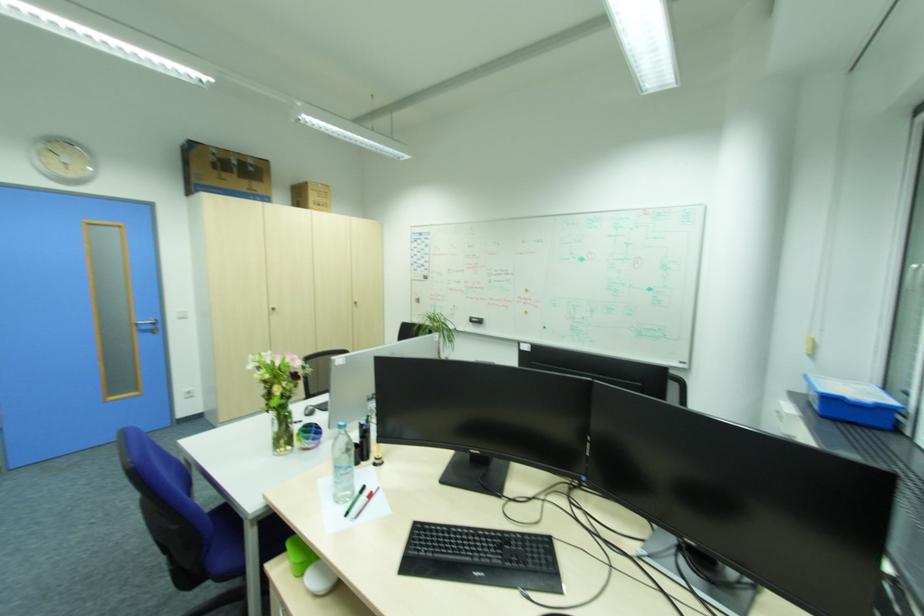
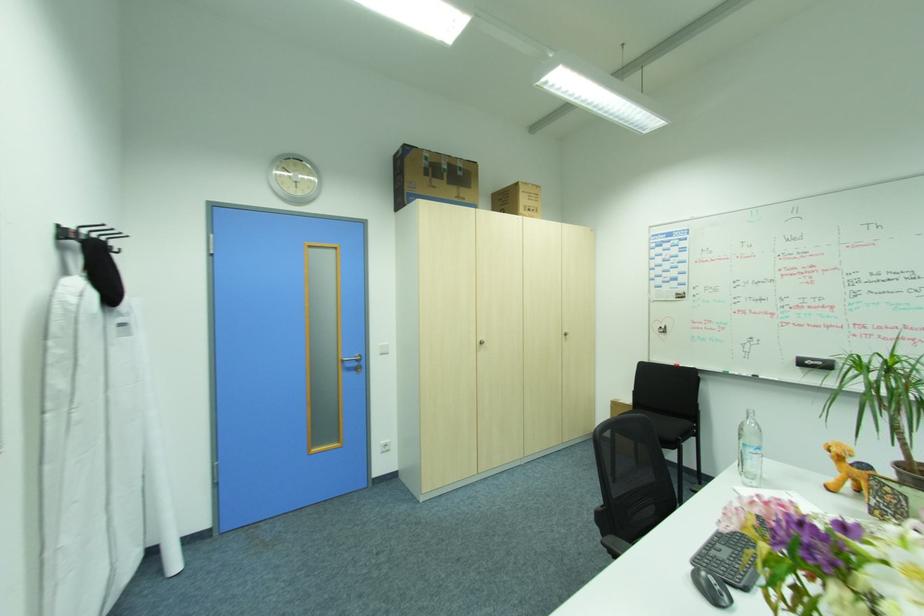
Where in the second image is the point corresponding to the point at 155,326 from the first image?

(360, 363)